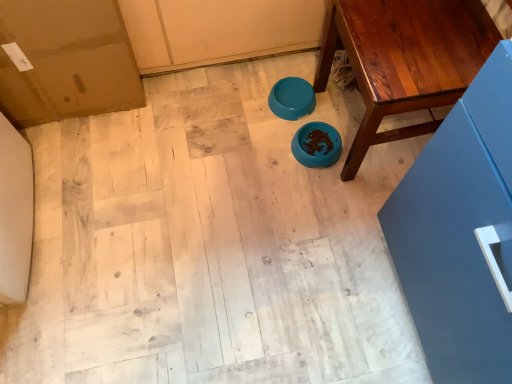
Find the location of a particular element. The width and height of the screenshot is (512, 384). teal glossy bowl at center, the first bowl when ordered from top to bottom is located at coordinates (292, 98).

In the scene shown: Is blue matte bowl at center, the second bowl in the top-to-bottom sequence, to the left of teal glossy bowl at center, the first bowl when ordered from top to bottom, from the viewer's perspective?

No.

Relative to teal glossy bowl at center, the first bowl when ordered from top to bottom, is blue matte bowl at center, the second bowl in the top-to-bottom sequence, in front or behind?

Clearly, blue matte bowl at center, the second bowl in the top-to-bottom sequence, is in front of teal glossy bowl at center, the first bowl when ordered from top to bottom.

Is blue matte bowl at center, the second bowl in the top-to-bottom sequence, located outside teal glossy bowl at center, the first bowl when ordered from top to bottom?

That's correct, blue matte bowl at center, the second bowl in the top-to-bottom sequence, is outside of teal glossy bowl at center, the first bowl when ordered from top to bottom.

Does blue matte bowl at center, the second bowl in the top-to-bottom sequence, have a larger size compared to teal glossy bowl at center, which appears as the second bowl when ordered from the bottom?

Indeed, blue matte bowl at center, the second bowl in the top-to-bottom sequence, has a larger size compared to teal glossy bowl at center, which appears as the second bowl when ordered from the bottom.

Between wooden table at center and blue matte bowl at center, marked as the 1th bowl in a bottom-to-top arrangement, which one is positioned behind?

blue matte bowl at center, marked as the 1th bowl in a bottom-to-top arrangement.

How far apart are wooden table at center and blue matte bowl at center, the second bowl in the top-to-bottom sequence?

A distance of 14.40 inches exists between wooden table at center and blue matte bowl at center, the second bowl in the top-to-bottom sequence.

Considering the relative sizes of wooden table at center and blue matte bowl at center, marked as the 1th bowl in a bottom-to-top arrangement, in the image provided, is wooden table at center bigger than blue matte bowl at center, marked as the 1th bowl in a bottom-to-top arrangement,?

Indeed, wooden table at center has a larger size compared to blue matte bowl at center, marked as the 1th bowl in a bottom-to-top arrangement.

Is wooden table at center not close to blue matte bowl at center, marked as the 1th bowl in a bottom-to-top arrangement?

Actually, wooden table at center and blue matte bowl at center, marked as the 1th bowl in a bottom-to-top arrangement, are a little close together.

How many degrees apart are the facing directions of teal glossy bowl at center, the first bowl when ordered from top to bottom, and blue matte bowl at center, marked as the 1th bowl in a bottom-to-top arrangement?

The facing directions of teal glossy bowl at center, the first bowl when ordered from top to bottom, and blue matte bowl at center, marked as the 1th bowl in a bottom-to-top arrangement, are 1.91e-06 degrees apart.

Which is less distant, (269, 104) or (295, 137)?

Point (269, 104) appears to be farther away from the viewer than point (295, 137).

This screenshot has width=512, height=384. Identify the location of bowl behind the blue matte bowl at center, the second bowl in the top-to-bottom sequence. (292, 98).

Is teal glossy bowl at center, the first bowl when ordered from top to bottom, with blue matte bowl at center, the second bowl in the top-to-bottom sequence?

No, teal glossy bowl at center, the first bowl when ordered from top to bottom, is not with blue matte bowl at center, the second bowl in the top-to-bottom sequence.

Relative to teal glossy bowl at center, which appears as the second bowl when ordered from the bottom, is wooden table at center in front or behind?

wooden table at center is in front of teal glossy bowl at center, which appears as the second bowl when ordered from the bottom.

Which is closer, (414,8) or (273,91)?

Point (414,8) appears to be closer to the viewer than point (273,91).

From a real-world perspective, is wooden table at center above or below teal glossy bowl at center, which appears as the second bowl when ordered from the bottom?

wooden table at center is above teal glossy bowl at center, which appears as the second bowl when ordered from the bottom.

From the image's perspective, is wooden table at center above or below teal glossy bowl at center, the first bowl when ordered from top to bottom?

wooden table at center is above teal glossy bowl at center, the first bowl when ordered from top to bottom.

Is blue matte bowl at center, marked as the 1th bowl in a bottom-to-top arrangement, bigger or smaller than wooden table at center?

Considering their sizes, blue matte bowl at center, marked as the 1th bowl in a bottom-to-top arrangement, takes up less space than wooden table at center.

Looking at this image, which is more to the right, blue matte bowl at center, marked as the 1th bowl in a bottom-to-top arrangement, or wooden table at center?

From the viewer's perspective, wooden table at center appears more on the right side.

Is wooden table at center inside blue matte bowl at center, the second bowl in the top-to-bottom sequence?

No, wooden table at center is not a part of blue matte bowl at center, the second bowl in the top-to-bottom sequence.

Is blue matte bowl at center, the second bowl in the top-to-bottom sequence, in front of wooden table at center?

No, blue matte bowl at center, the second bowl in the top-to-bottom sequence, is further to the viewer.

From a real-world perspective, which object rests below the other?

From a 3D spatial view, teal glossy bowl at center, the first bowl when ordered from top to bottom, is below.

Is point (278, 87) farther from camera compared to point (351, 179)?

Yes, point (278, 87) is farther from viewer.

Is teal glossy bowl at center, which appears as the second bowl when ordered from the bottom, looking in the opposite direction of wooden table at center?

Yes, teal glossy bowl at center, which appears as the second bowl when ordered from the bottom, is facing away from wooden table at center.

How many degrees apart are the facing directions of teal glossy bowl at center, the first bowl when ordered from top to bottom, and wooden table at center?

0.154 degrees.

At what (x,y) coordinates should I click in order to perform the action: click on bowl that appears below the teal glossy bowl at center, the first bowl when ordered from top to bottom (from the image's perspective). Please return your answer as a coordinate pair (x, y). This screenshot has width=512, height=384. Looking at the image, I should click on (317, 145).

Where is `table in front of the blue matte bowl at center, the second bowl in the top-to-bottom sequence`? The width and height of the screenshot is (512, 384). table in front of the blue matte bowl at center, the second bowl in the top-to-bottom sequence is located at coordinates (404, 59).

Considering their positions, is wooden table at center positioned closer to blue matte bowl at center, the second bowl in the top-to-bottom sequence, than teal glossy bowl at center, which appears as the second bowl when ordered from the bottom?

The object closer to blue matte bowl at center, the second bowl in the top-to-bottom sequence, is teal glossy bowl at center, which appears as the second bowl when ordered from the bottom.

Estimate the real-world distances between objects in this image. Which object is closer to blue matte bowl at center, marked as the 1th bowl in a bottom-to-top arrangement, teal glossy bowl at center, the first bowl when ordered from top to bottom, or wooden table at center?

The object closer to blue matte bowl at center, marked as the 1th bowl in a bottom-to-top arrangement, is teal glossy bowl at center, the first bowl when ordered from top to bottom.

Which object lies nearer to the anchor point wooden table at center, blue matte bowl at center, the second bowl in the top-to-bottom sequence, or teal glossy bowl at center, which appears as the second bowl when ordered from the bottom?

The object closer to wooden table at center is blue matte bowl at center, the second bowl in the top-to-bottom sequence.

Based on their spatial positions, is blue matte bowl at center, the second bowl in the top-to-bottom sequence, or wooden table at center closer to teal glossy bowl at center, which appears as the second bowl when ordered from the bottom?

Among the two, blue matte bowl at center, the second bowl in the top-to-bottom sequence, is located nearer to teal glossy bowl at center, which appears as the second bowl when ordered from the bottom.

Based on their spatial positions, is wooden table at center or blue matte bowl at center, marked as the 1th bowl in a bottom-to-top arrangement, closer to teal glossy bowl at center, which appears as the second bowl when ordered from the bottom?

blue matte bowl at center, marked as the 1th bowl in a bottom-to-top arrangement, is closer to teal glossy bowl at center, which appears as the second bowl when ordered from the bottom.

Based on their spatial positions, is teal glossy bowl at center, the first bowl when ordered from top to bottom, or blue matte bowl at center, marked as the 1th bowl in a bottom-to-top arrangement, further from wooden table at center?

The object further to wooden table at center is teal glossy bowl at center, the first bowl when ordered from top to bottom.

Locate an element on the screen. The height and width of the screenshot is (384, 512). bowl between wooden table at center and teal glossy bowl at center, which appears as the second bowl when ordered from the bottom, along the z-axis is located at coordinates (317, 145).